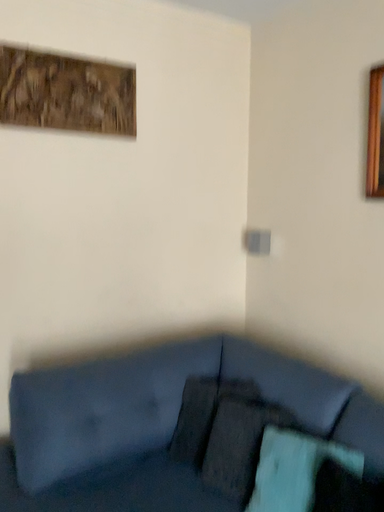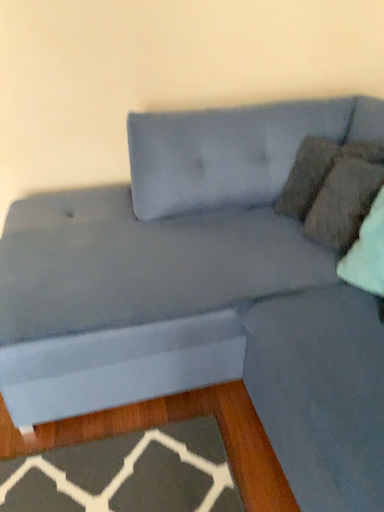
Question: Which way did the camera rotate in the video?

Choices:
 (A) rotated downward
 (B) rotated upward

Answer: (A)